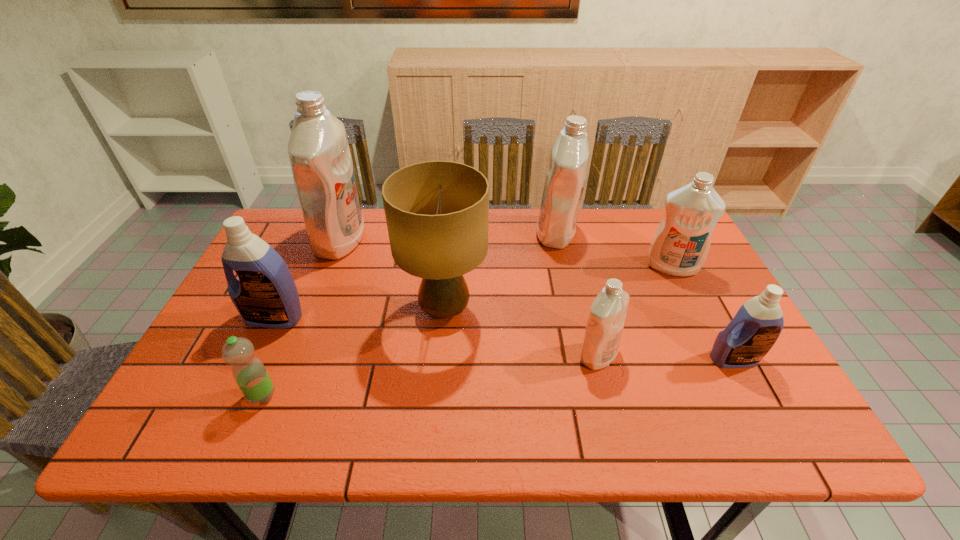
The width and height of the screenshot is (960, 540). I want to click on free space between the nearest white detergent and the third smallest white detergent, so click(x=577, y=294).

At what (x,y) coordinates should I click in order to perform the action: click on unoccupied position between the nearest object and the third biggest white detergent. Please return your answer as a coordinate pair (x, y). The width and height of the screenshot is (960, 540). Looking at the image, I should click on (467, 331).

Identify the location of free spot between the nearest white detergent and the fourth object from left to right. This screenshot has height=540, width=960. (521, 333).

Find the location of a particular element. The image size is (960, 540). free space that is in between the biggest white detergent and the nearest object is located at coordinates (301, 318).

Where is `empty space that is in between the nearest white detergent and the tallest detergent`? empty space that is in between the nearest white detergent and the tallest detergent is located at coordinates (469, 298).

Find the location of a particular element. vacant area that lies between the biggest white detergent and the bigger blue detergent is located at coordinates (307, 279).

Locate an element on the screen. The height and width of the screenshot is (540, 960). free point between the left blue detergent and the smallest white detergent is located at coordinates (437, 336).

Locate an element on the screen. Image resolution: width=960 pixels, height=540 pixels. the second closest object to the third biggest white detergent is located at coordinates (755, 328).

Where is `object that stands as the sixth closest to the nearest object`? This screenshot has width=960, height=540. object that stands as the sixth closest to the nearest object is located at coordinates (755, 328).

In order to click on detergent identified as the fourth closest to the second biggest white detergent in this screenshot , I will do `click(318, 149)`.